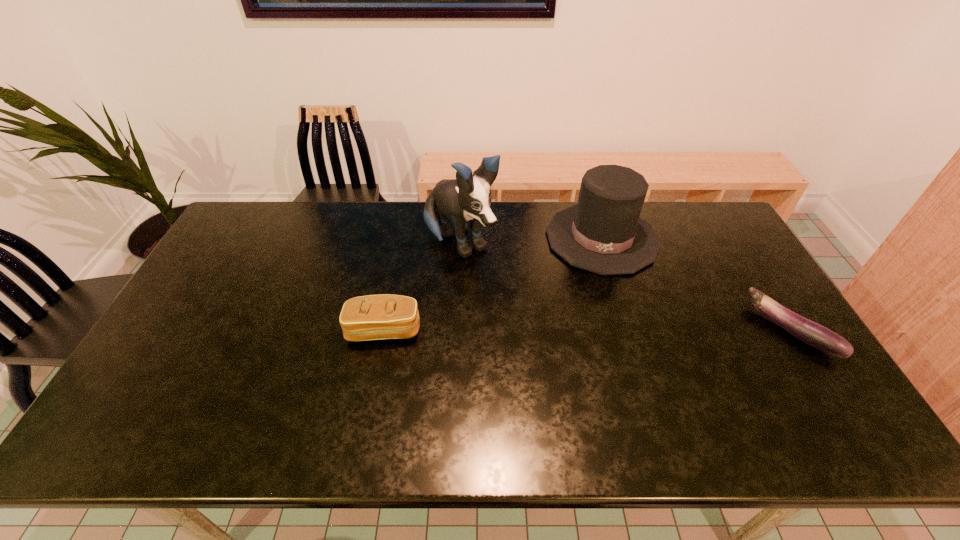
Locate an element on the screen. The height and width of the screenshot is (540, 960). free space on the desktop that is between the clutch bag and the eggplant and is positioned on the front-facing side of the tallest object is located at coordinates click(x=539, y=330).

At what (x,y) coordinates should I click in order to perform the action: click on free space on the desktop that is between the clutch bag and the eggplant and is positioned on the front of the third shortest object with the decoration. Please return your answer as a coordinate pair (x, y). Looking at the image, I should click on (601, 330).